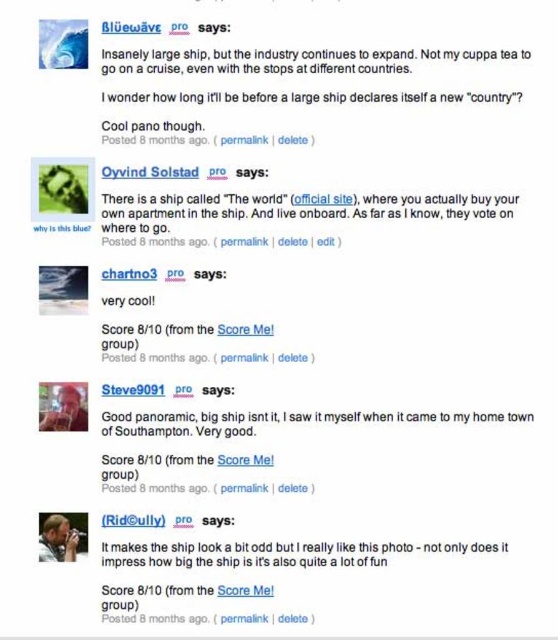
Question: Is white glossy text at center below matte black ship at center?

Choices:
 (A) no
 (B) yes

Answer: (A)

Question: Does white glossy text at center have a lesser width compared to good panoramic big ship at center?

Choices:
 (A) yes
 (B) no

Answer: (A)

Question: Which of the following is the farthest from the observer?

Choices:
 (A) matte black ship at center
 (B) good panoramic big ship at center
 (C) white glossy text at center

Answer: (C)

Question: Which point appears farthest from the camera in this image?

Choices:
 (A) (198, 545)
 (B) (381, 209)
 (C) (127, 417)

Answer: (B)

Question: Which object is farther from the camera taking this photo?

Choices:
 (A) white glossy text at center
 (B) good panoramic big ship at center
 (C) matte black ship at center

Answer: (A)

Question: Is white glossy text at center thinner than matte black ship at center?

Choices:
 (A) no
 (B) yes

Answer: (A)